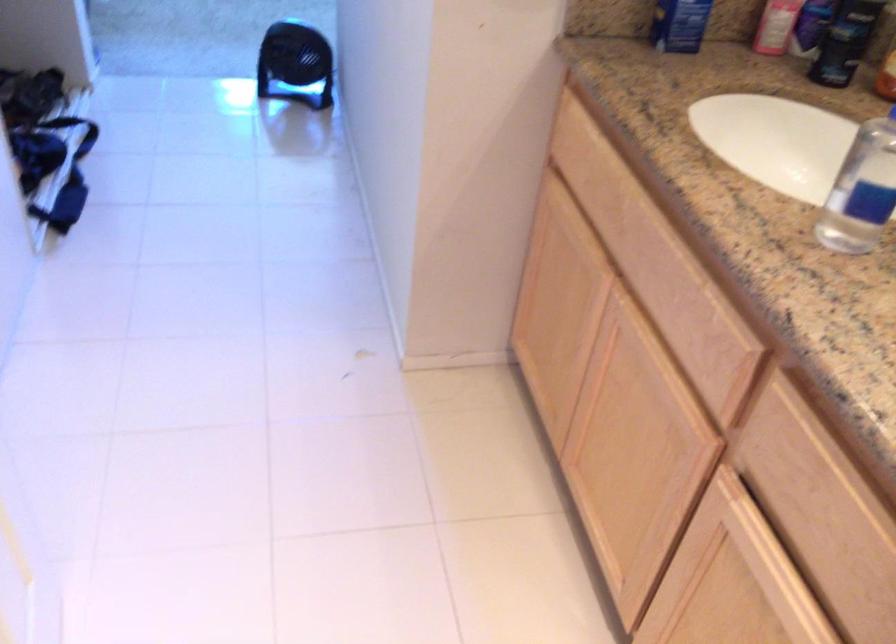
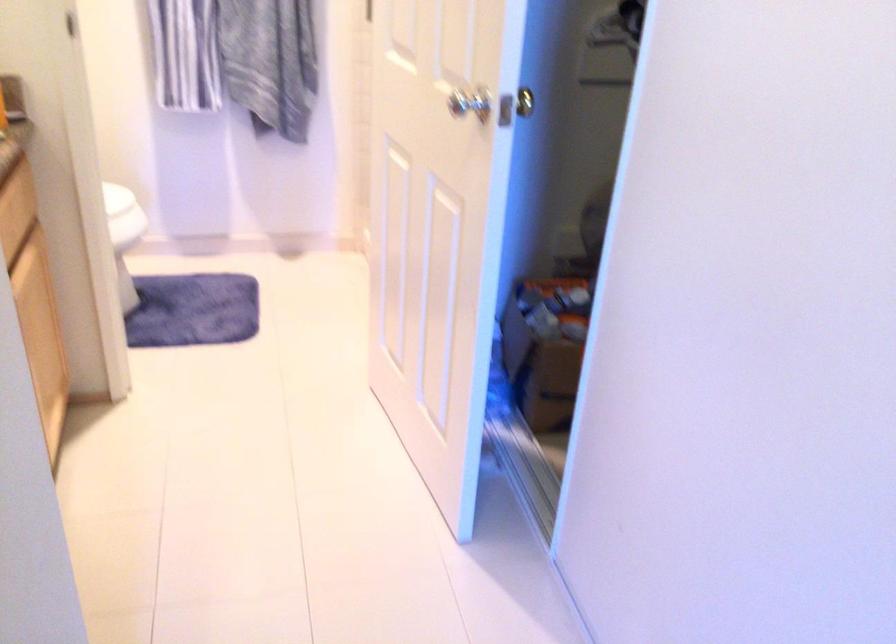
Find the pixel in the second image that matches the point at 782,433 in the first image.

(12, 229)